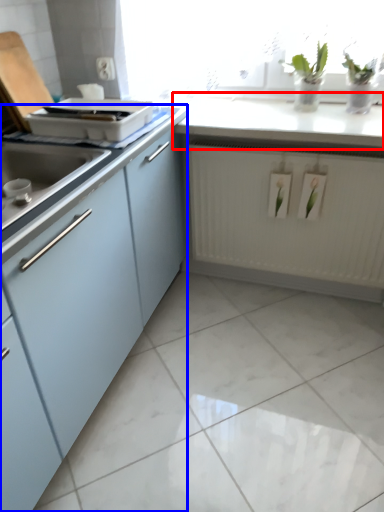
Question: Which point is closer to the camera, countertop (highlighted by a red box) or cabinetry (highlighted by a blue box)?

Choices:
 (A) countertop
 (B) cabinetry

Answer: (B)